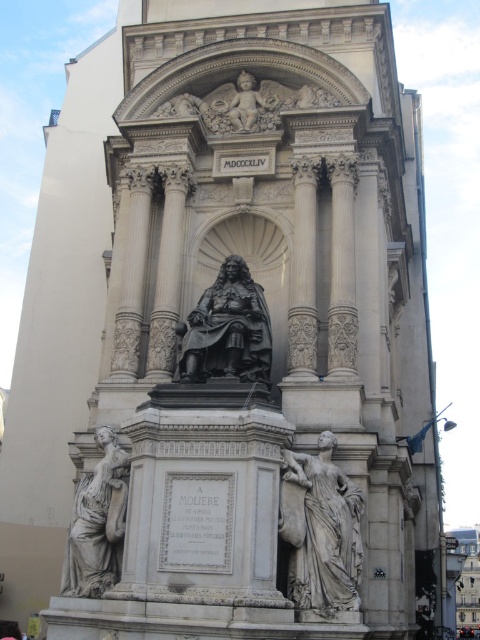
Question: Is black polished stone statue at center above white marble statue at lower left?

Choices:
 (A) no
 (B) yes

Answer: (B)

Question: Which object appears farthest from the camera in this image?

Choices:
 (A) white marble statue at lower left
 (B) matte stone cherub at upper center
 (C) black polished stone statue at center
 (D) white marble statue at center

Answer: (B)

Question: Can you confirm if white marble statue at lower left is positioned above matte stone cherub at upper center?

Choices:
 (A) no
 (B) yes

Answer: (A)

Question: Which point appears closest to the camera in this image?

Choices:
 (A) (229, 314)
 (B) (300, 500)
 (C) (242, 104)
 (D) (74, 563)

Answer: (B)

Question: Estimate the real-world distances between objects in this image. Which object is farther from the white marble statue at center?

Choices:
 (A) white marble statue at lower left
 (B) black polished stone statue at center
 (C) matte stone cherub at upper center

Answer: (C)

Question: Is white marble statue at center to the left of white marble statue at lower left from the viewer's perspective?

Choices:
 (A) no
 (B) yes

Answer: (A)